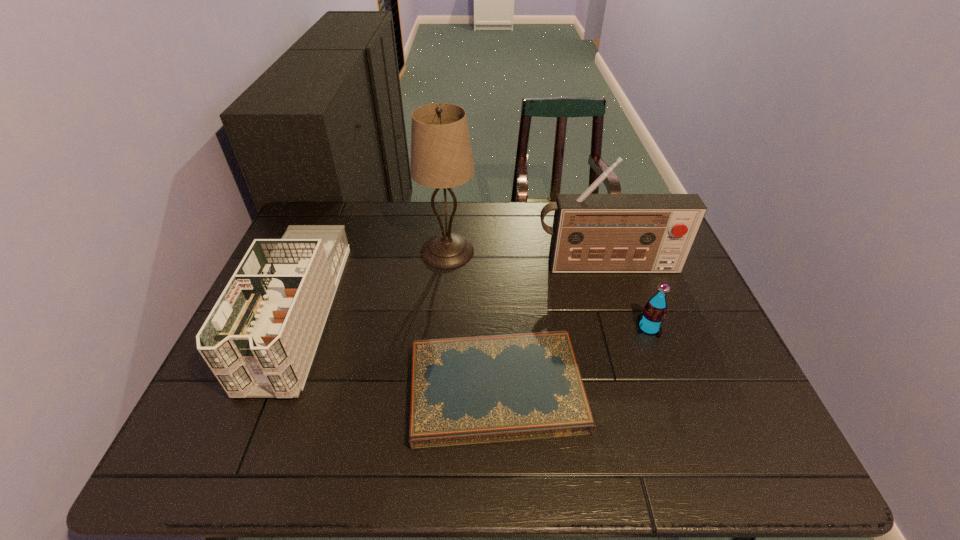
Locate an element on the screen. vacant space at the far left corner is located at coordinates pos(347,213).

You are a GUI agent. You are given a task and a screenshot of the screen. Output one action in this format:
    pyautogui.click(x=<x>, y=<y>)
    Task: Click on the blank area at the near right corner
    The width and height of the screenshot is (960, 540).
    Given the screenshot: What is the action you would take?
    pyautogui.click(x=724, y=461)

This screenshot has height=540, width=960. Identify the location of vacant point located between the lampshade and the fourth tallest object. (548, 289).

At what (x,y) coordinates should I click in order to perform the action: click on free area in between the lampshade and the second tallest object. Please return your answer as a coordinate pair (x, y). The width and height of the screenshot is (960, 540). Looking at the image, I should click on (x=527, y=259).

I want to click on vacant area between the radio receiver and the paperback book, so click(552, 328).

Locate an element on the screen. The image size is (960, 540). unoccupied position between the shortest object and the lampshade is located at coordinates (472, 320).

Identify the location of free spot between the tallest object and the fourth shortest object. The width and height of the screenshot is (960, 540). (527, 259).

You are a GUI agent. You are given a task and a screenshot of the screen. Output one action in this format:
    pyautogui.click(x=<x>, y=<y>)
    Task: Click on the free spot between the paperback book and the lampshade
    The width and height of the screenshot is (960, 540).
    Given the screenshot: What is the action you would take?
    pyautogui.click(x=472, y=320)

Locate an element on the screen. The image size is (960, 540). free point between the dollhouse and the lampshade is located at coordinates (372, 282).

Find the location of `empty space between the dollhouse and the soda`. empty space between the dollhouse and the soda is located at coordinates (473, 320).